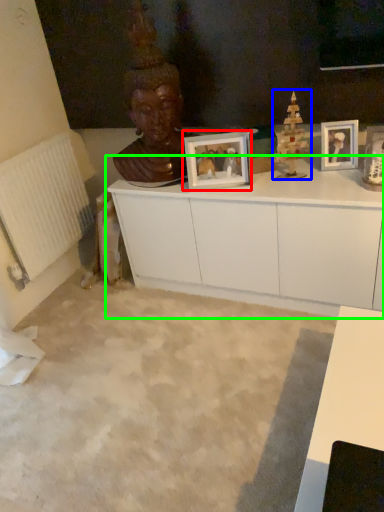
Question: Which is nearer to the picture frame (highlighted by a red box)? toy (highlighted by a blue box) or cabinetry (highlighted by a green box).

Choices:
 (A) toy
 (B) cabinetry

Answer: (A)